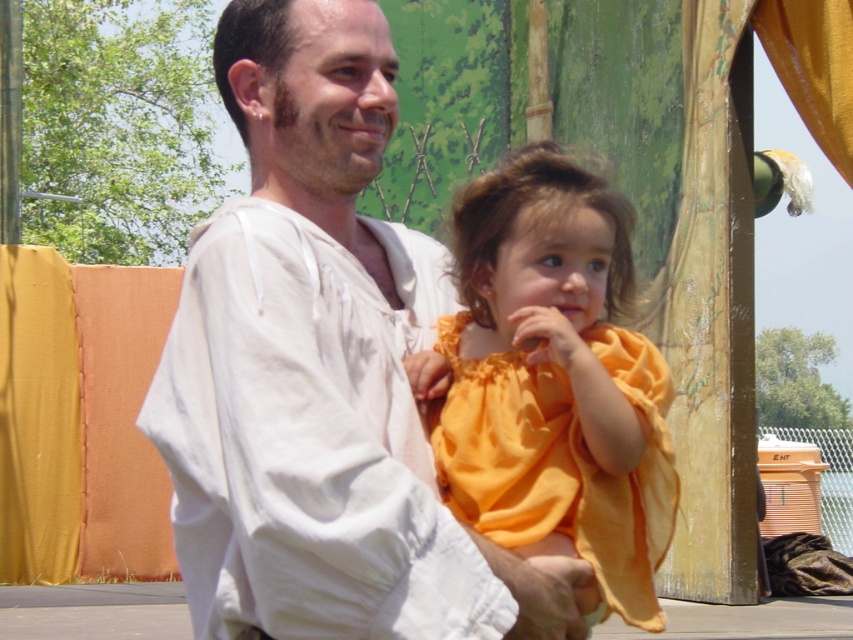
You are standing in front of the image. Where is the white cotton shirt at center located in terms of coordinates?

The white cotton shirt at center is located at coordinates point (318, 371).

You are a photographer trying to capture a candid shot of the white cotton shirt at center and the matte orange dress at center. Since you want to ensure both are fully visible in the frame, which one should you focus on first to avoid cropping either?

The white cotton shirt at center is much taller than the matte orange dress at center, so you should focus on the white cotton shirt at center first to ensure its full height is captured without cropping.